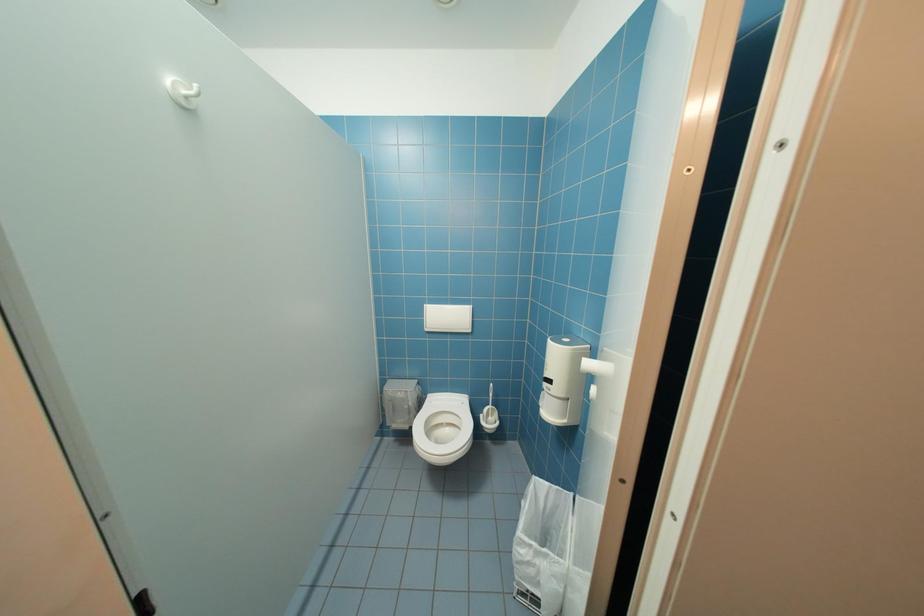
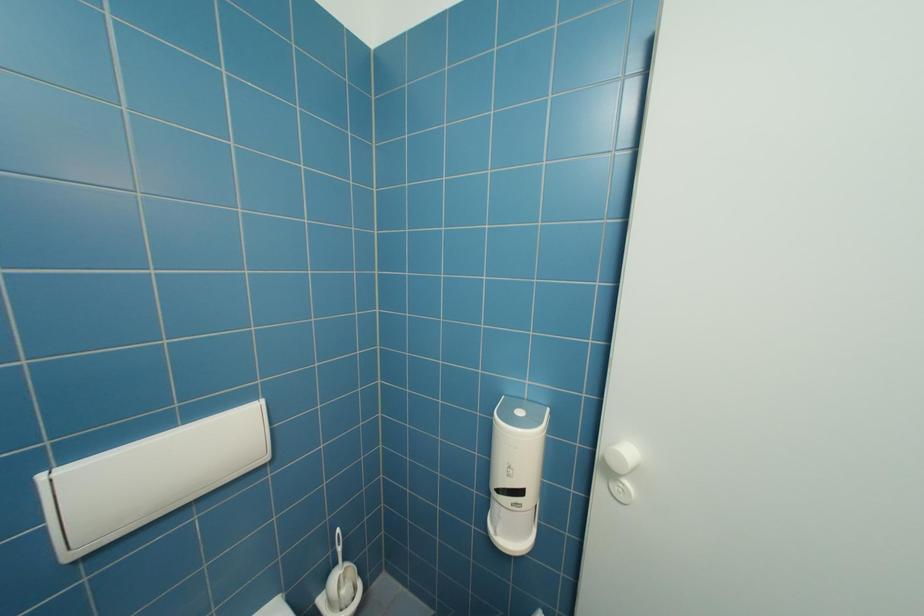
Question: The camera is either moving clockwise (left) or counter-clockwise (right) around the object. The first image is from the beginning of the video and the second image is from the end. Is the camera moving left or right when shooting the video?

Choices:
 (A) Left
 (B) Right

Answer: (A)